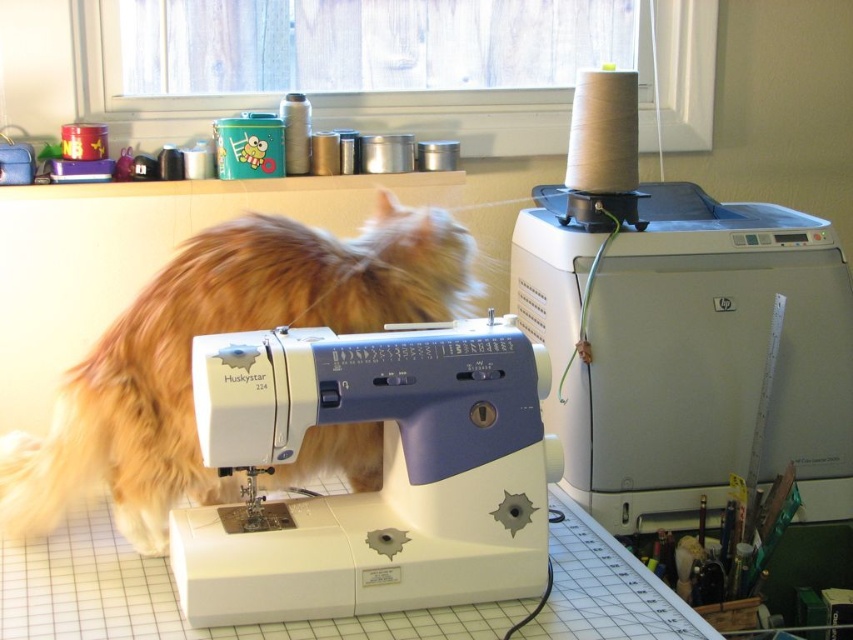
Between white plastic sewing machine at center and fluffy orange fur at center, which one appears on the right side from the viewer's perspective?

Positioned to the right is white plastic sewing machine at center.

Does point (502, 348) come in front of point (367, 273)?

Yes, it is in front of point (367, 273).

Does point (366, 362) come behind point (241, 316)?

No, it is in front of (241, 316).

Find the location of a particular element. white plastic sewing machine at center is located at coordinates (384, 472).

Which is more to the right, white plastic sewing machine at upper right or white plastic sewing machine at center?

Positioned to the right is white plastic sewing machine at upper right.

Is white plastic sewing machine at upper right wider than white plastic sewing machine at center?

Indeed, white plastic sewing machine at upper right has a greater width compared to white plastic sewing machine at center.

Locate an element on the screen. white plastic sewing machine at upper right is located at coordinates (682, 332).

Is white plastic sewing machine at upper right smaller than fluffy orange fur at center?

Actually, white plastic sewing machine at upper right might be larger than fluffy orange fur at center.

Is point (809, 500) less distant than point (86, 403)?

No, (809, 500) is behind (86, 403).

Locate an element on the screen. The image size is (853, 640). white plastic sewing machine at upper right is located at coordinates (682, 332).